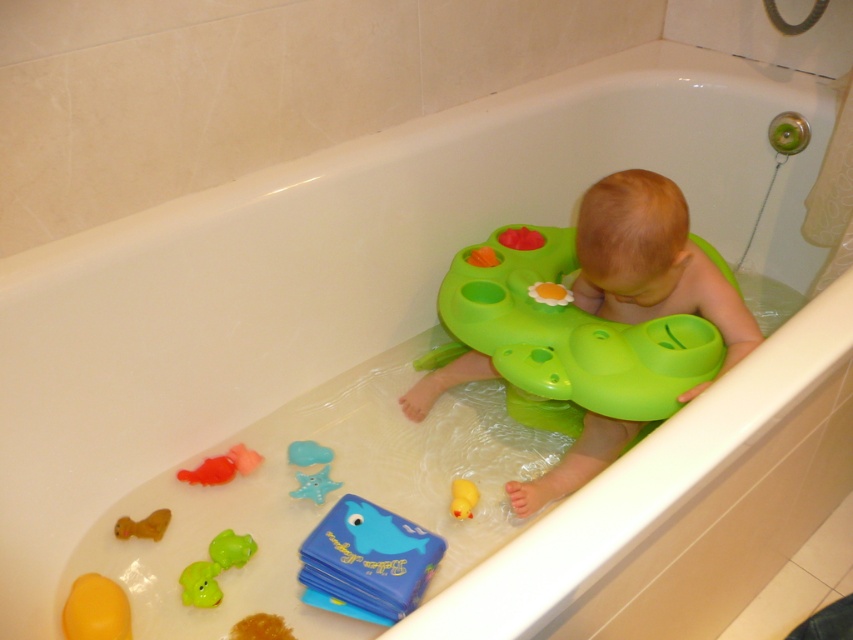
Question: Is blue rubber starfish at lower center positioned before yellow rubber duck at lower center?

Choices:
 (A) yes
 (B) no

Answer: (B)

Question: Is blue rubber book at lower center positioned behind yellow rubber duck at lower left?

Choices:
 (A) no
 (B) yes

Answer: (A)

Question: Does green rubber duck at lower left come in front of rubber duck at lower left?

Choices:
 (A) yes
 (B) no

Answer: (A)

Question: Which point is closer to the camera?

Choices:
 (A) brown rubber duck at lower left
 (B) yellow rubber duck at lower center
 (C) blue rubber book at lower center

Answer: (C)

Question: Estimate the real-world distances between objects in this image. Which object is farther from the brown rubber duck at lower left?

Choices:
 (A) yellow rubber duck at lower center
 (B) green rubber duck at lower left

Answer: (A)

Question: Which object appears closest to the camera in this image?

Choices:
 (A) green rubber duck at lower left
 (B) yellow rubber duck at lower center
 (C) yellow rubber duck at lower left

Answer: (C)